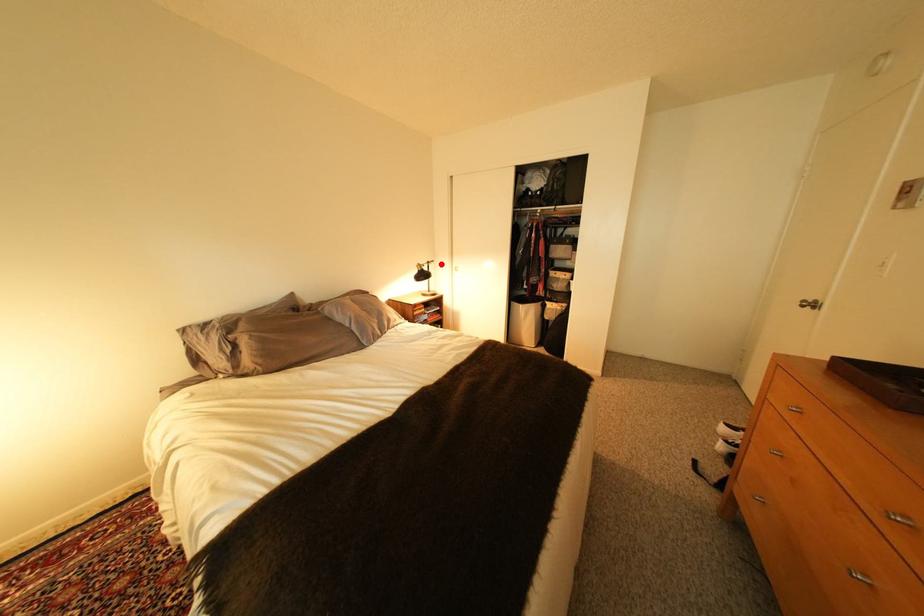
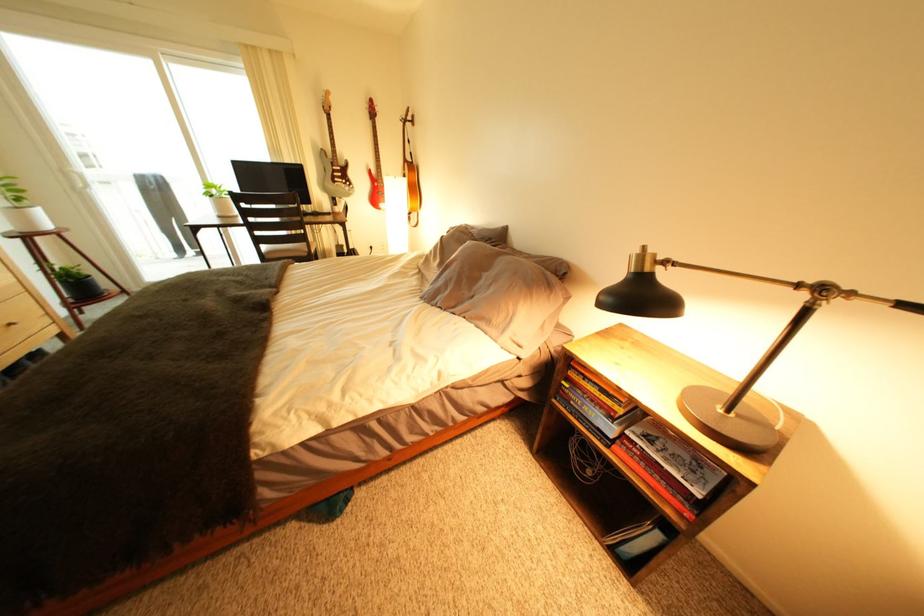
Locate, in the second image, the point that corresponds to the highlighted location in the first image.

(834, 291)